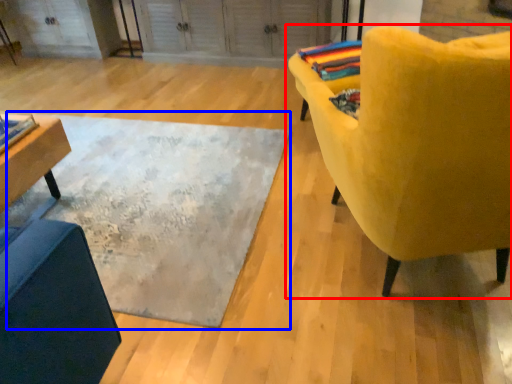
Question: Which object is closer to the camera taking this photo, chair (highlighted by a red box) or mat (highlighted by a blue box)?

Choices:
 (A) chair
 (B) mat

Answer: (A)